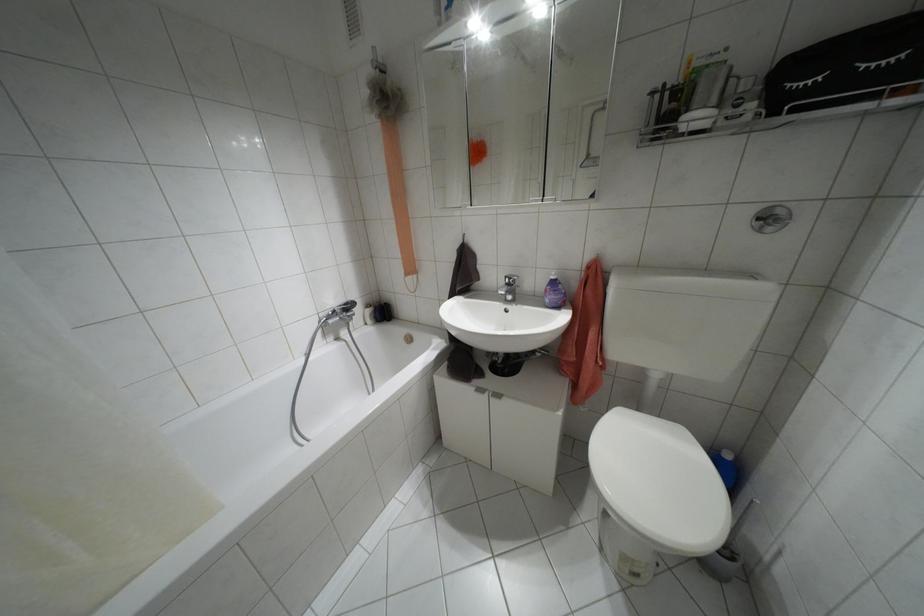
Where would you turn the sink faucet lever? Please return your answer as a coordinate pair (x, y).

(511, 280)